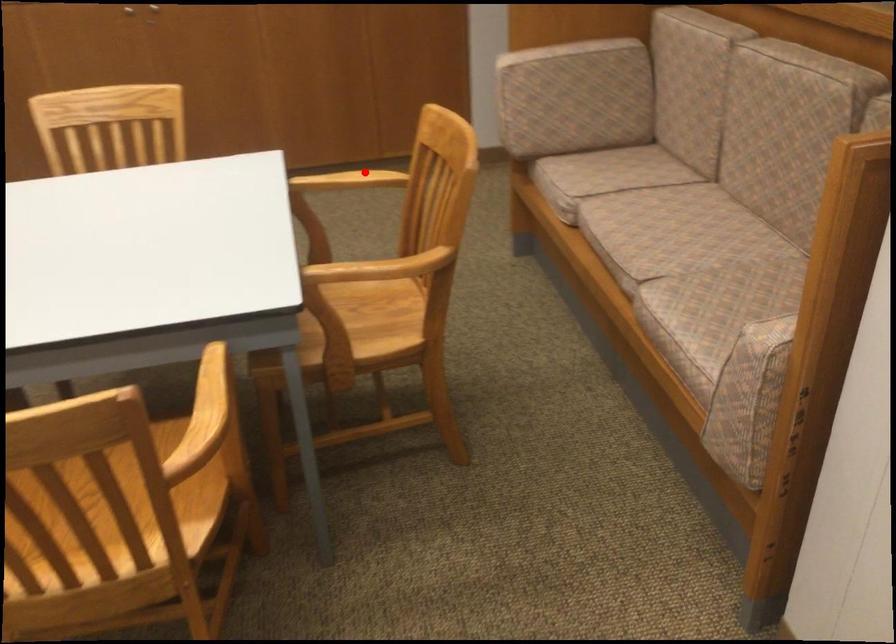
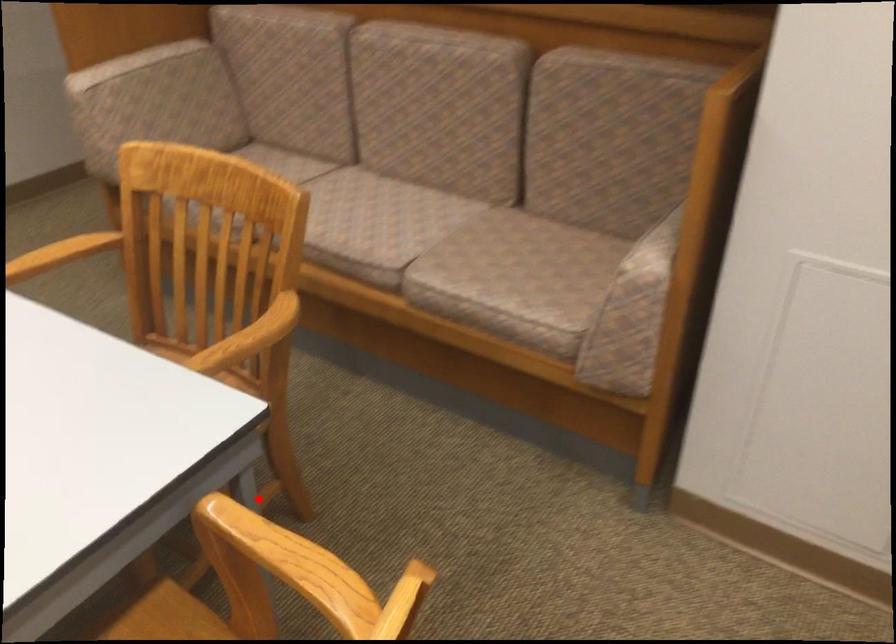
I am providing you with two images of the same scene from different viewpoints. A red point is marked on the first image and another point is marked on the second image. Does the point marked in image1 correspond to the same location as the one in image2?

No